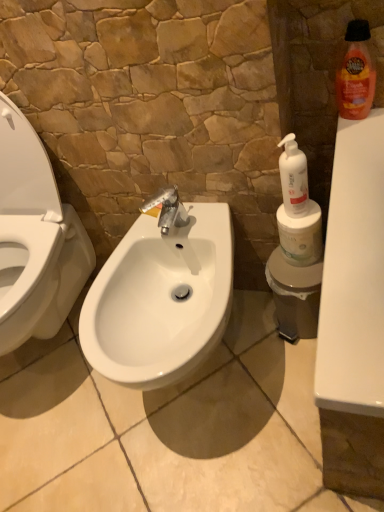
Locate an element on the screen. Image resolution: width=384 pixels, height=512 pixels. free space underneath white glossy sink at center (from a real-world perspective) is located at coordinates (212, 373).